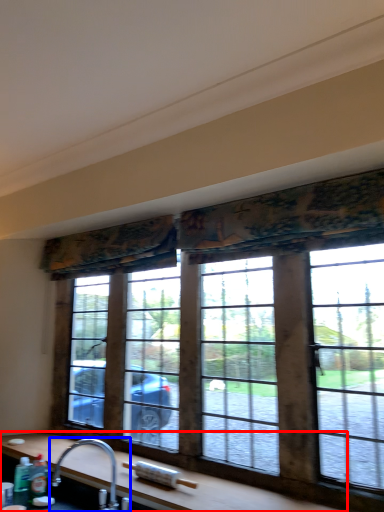
Question: Among these objects, which one is farthest to the camera, counter top (highlighted by a red box) or tap (highlighted by a blue box)?

Choices:
 (A) counter top
 (B) tap

Answer: (B)